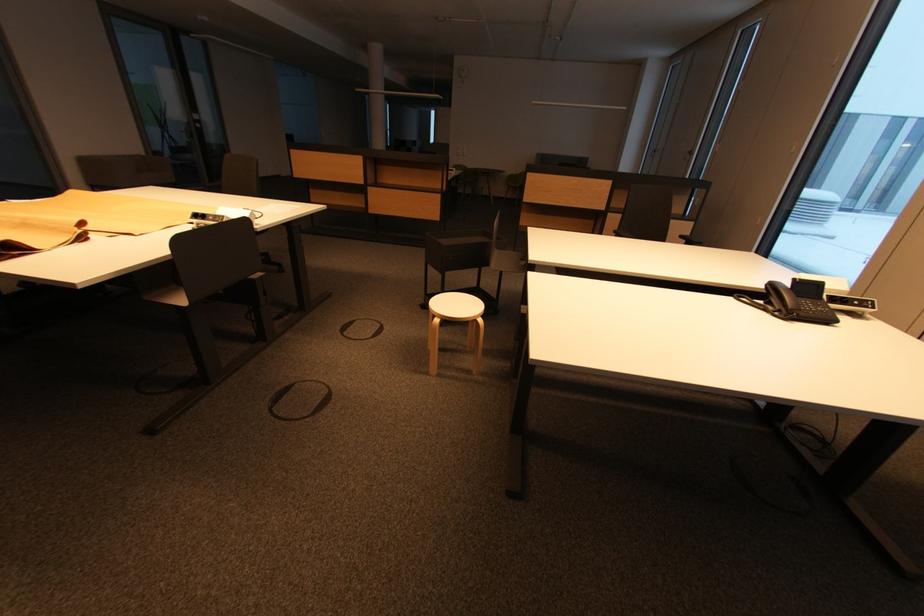
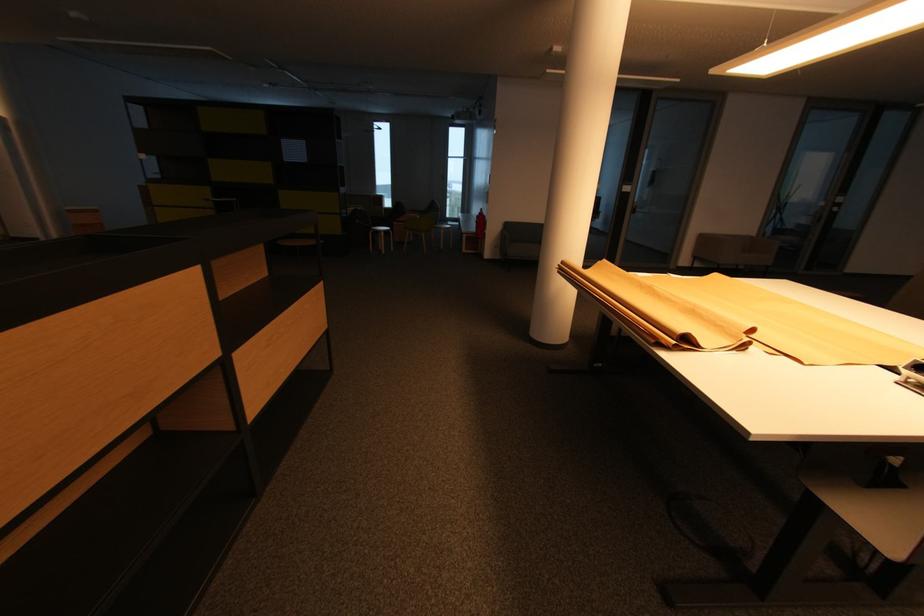
Question: The camera is either moving clockwise (left) or counter-clockwise (right) around the object. The first image is from the beginning of the video and the second image is from the end. Is the camera moving left or right when shooting the video?

Choices:
 (A) Left
 (B) Right

Answer: (B)